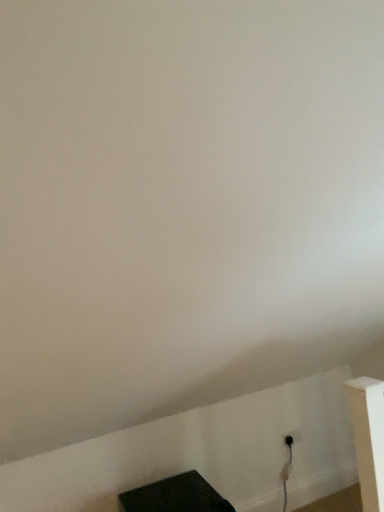
Question: Considering the positions of black matte tv at lower center and black plastic outlet at lower right in the image, is black matte tv at lower center taller or shorter than black plastic outlet at lower right?

Choices:
 (A) short
 (B) tall

Answer: (B)

Question: Which is correct: black matte tv at lower center is inside black plastic outlet at lower right, or outside of it?

Choices:
 (A) outside
 (B) inside

Answer: (A)

Question: From a real-world perspective, is black matte tv at lower center positioned above or below black plastic outlet at lower right?

Choices:
 (A) above
 (B) below

Answer: (B)

Question: Is black plastic outlet at lower right spatially inside black matte tv at lower center, or outside of it?

Choices:
 (A) outside
 (B) inside

Answer: (A)

Question: Is black plastic outlet at lower right to the left or to the right of black matte tv at lower center in the image?

Choices:
 (A) left
 (B) right

Answer: (B)

Question: From a real-world perspective, is black plastic outlet at lower right above or below black matte tv at lower center?

Choices:
 (A) below
 (B) above

Answer: (B)

Question: Considering the positions of black plastic outlet at lower right and black matte tv at lower center in the image, is black plastic outlet at lower right wider or thinner than black matte tv at lower center?

Choices:
 (A) thin
 (B) wide

Answer: (A)